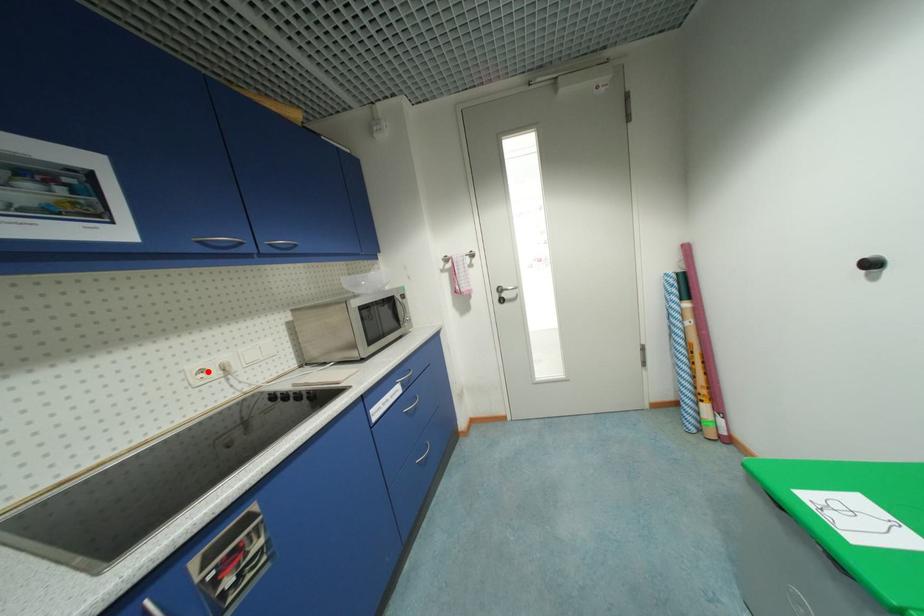
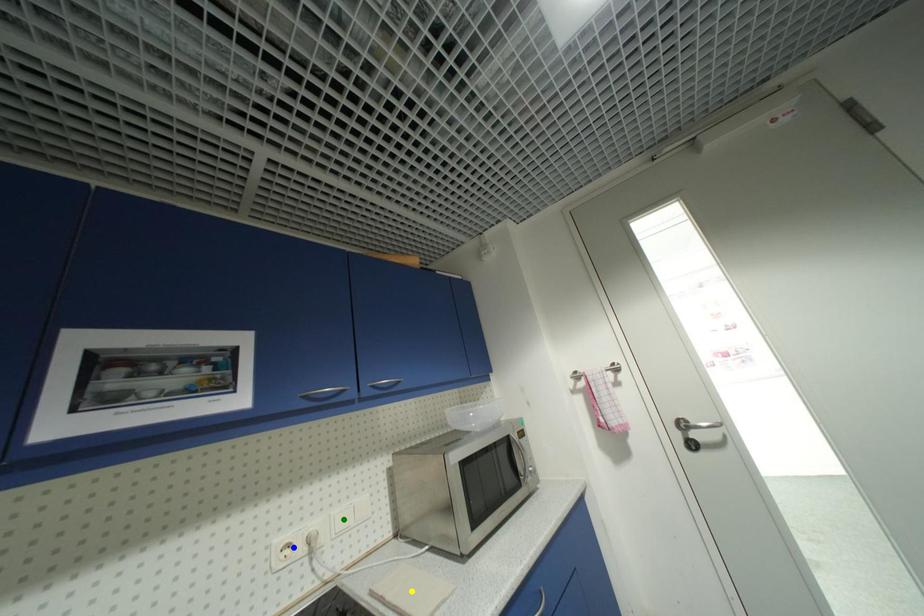
Question: I am providing you with two images of the same scene from different viewpoints. A red point is marked on the first image. You are given multiple points on the second image. In image 2, which mark is for the same physical point as the one in image 1?

Choices:
 (A) yellow point
 (B) blue point
 (C) green point

Answer: (B)